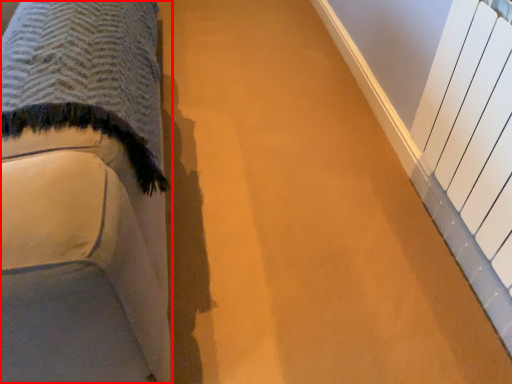
Question: In this image, where is furniture (annotated by the red box) located relative to radiator?

Choices:
 (A) right
 (B) left

Answer: (B)